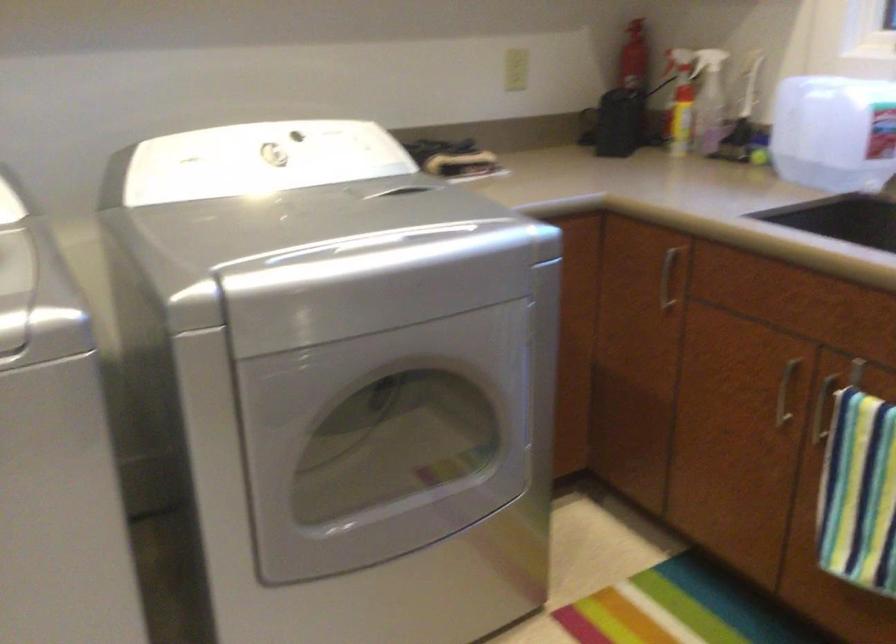
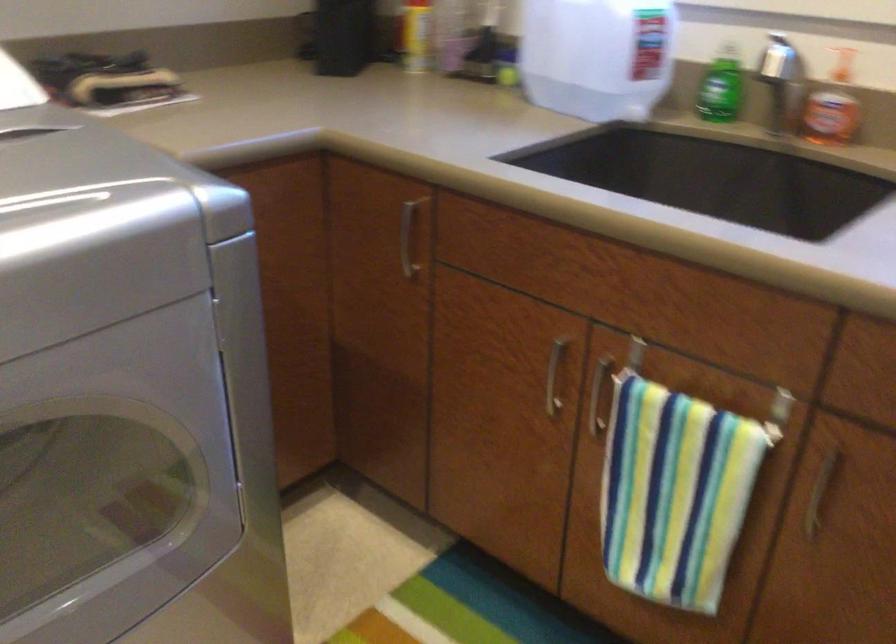
Find the pixel in the second image that matches the point at 666,279 in the first image.

(407, 238)